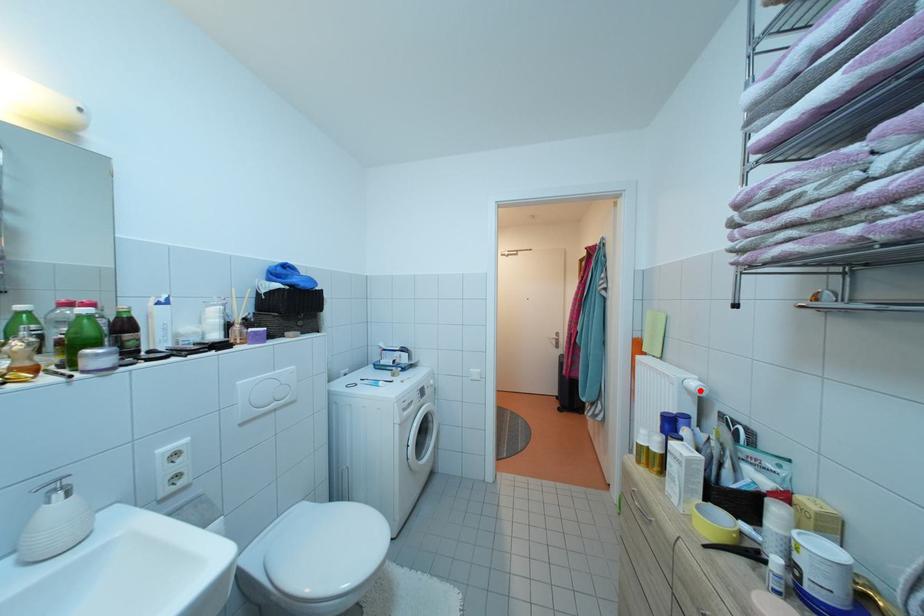
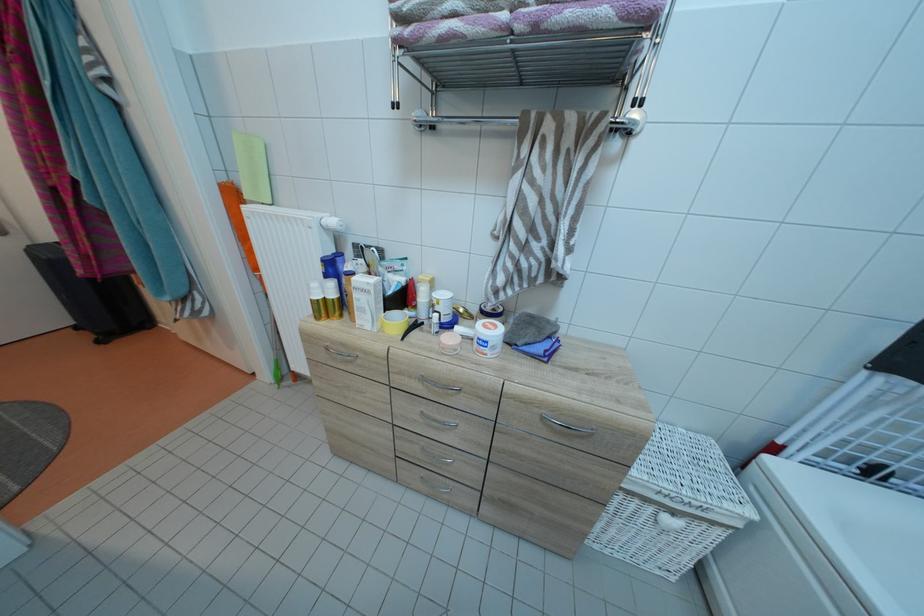
Find the pixel in the second image that matches the highlighted location in the first image.

(341, 227)